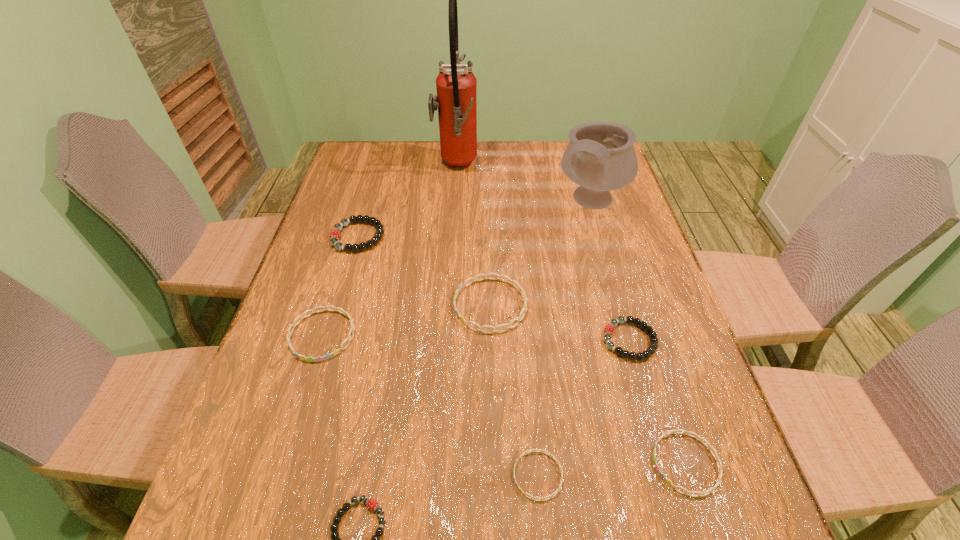
At what (x,y) coordinates should I click in order to perform the action: click on fire extinguisher. Please return your answer as a coordinate pair (x, y). The width and height of the screenshot is (960, 540). Looking at the image, I should click on (456, 99).

At what (x,y) coordinates should I click in order to perform the action: click on pottery. Please return your answer as a coordinate pair (x, y). This screenshot has width=960, height=540. Looking at the image, I should click on (600, 157).

At what (x,y) coordinates should I click in order to perform the action: click on the second tallest object. Please return your answer as a coordinate pair (x, y). Looking at the image, I should click on (600, 157).

Find the location of a particular element. the biggest blue bracelet is located at coordinates (480, 328).

This screenshot has height=540, width=960. In order to click on the farthest black bracelet in this screenshot , I will do `click(335, 233)`.

Find the location of a particular element. The width and height of the screenshot is (960, 540). the farthest bracelet is located at coordinates (335, 233).

The image size is (960, 540). Identify the location of the leftmost blue bracelet. (336, 351).

Find the location of a particular element. This screenshot has width=960, height=540. the second farthest black bracelet is located at coordinates (609, 329).

The image size is (960, 540). Identify the location of the rightmost black bracelet. (609, 329).

This screenshot has width=960, height=540. What are the coordinates of `the second smallest blue bracelet` in the screenshot? It's located at (720, 470).